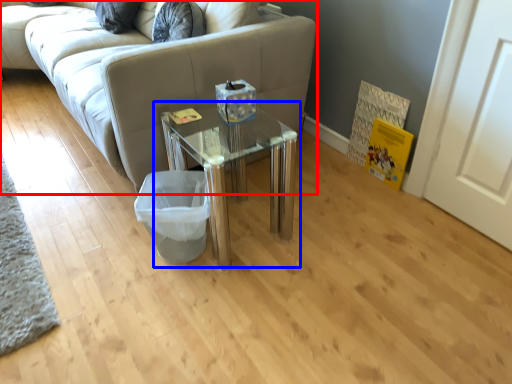
Question: Which point is closer to the camera, studio couch (highlighted by a red box) or table (highlighted by a blue box)?

Choices:
 (A) studio couch
 (B) table

Answer: (B)